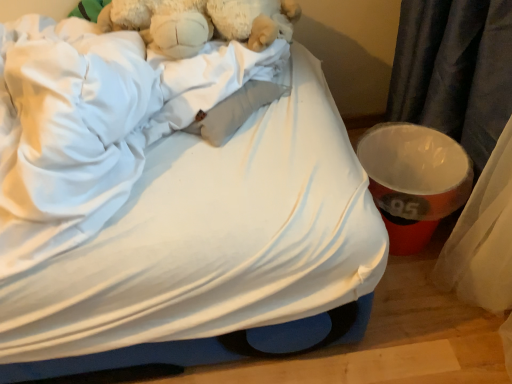
This screenshot has width=512, height=384. Describe the element at coordinates (211, 250) in the screenshot. I see `white fabric bed at upper left` at that location.

Locate an element on the screen. white fabric bed at upper left is located at coordinates (211, 250).

In order to face fluffy white teddy bear at upper left, should I rotate leftwards or rightwards?

A 9.747 degree turn to the left will do.

Where is `fluffy white teddy bear at upper left`? fluffy white teddy bear at upper left is located at coordinates (201, 22).

The height and width of the screenshot is (384, 512). Describe the element at coordinates (201, 22) in the screenshot. I see `fluffy white teddy bear at upper left` at that location.

Measure the distance between point (x=207, y=40) and camera.

They are 34.72 inches apart.

Where is `white fabric bed at upper left`? white fabric bed at upper left is located at coordinates 211,250.

Consider the image. Can you confirm if fluffy white teddy bear at upper left is positioned to the left of white fabric bed at upper left?

Incorrect, fluffy white teddy bear at upper left is not on the left side of white fabric bed at upper left.

In the scene shown: Is the position of fluffy white teddy bear at upper left less distant than that of white fabric bed at upper left?

No, it is not.

Considering the positions of points (161, 26) and (37, 25), is point (161, 26) closer to camera compared to point (37, 25)?

Yes, it is in front of point (37, 25).

From the image's perspective, is fluffy white teddy bear at upper left below white fabric bed at upper left?

Actually, fluffy white teddy bear at upper left appears above white fabric bed at upper left in the image.

From a real-world perspective, is fluffy white teddy bear at upper left physically above white fabric bed at upper left?

Correct, in the physical world, fluffy white teddy bear at upper left is higher than white fabric bed at upper left.

Is fluffy white teddy bear at upper left wider than white fabric bed at upper left?

Incorrect, the width of fluffy white teddy bear at upper left does not surpass that of white fabric bed at upper left.

Can you confirm if fluffy white teddy bear at upper left is shorter than white fabric bed at upper left?

Correct, fluffy white teddy bear at upper left is not as tall as white fabric bed at upper left.

Considering the sizes of objects fluffy white teddy bear at upper left and white fabric bed at upper left in the image provided, who is smaller, fluffy white teddy bear at upper left or white fabric bed at upper left?

With smaller size is fluffy white teddy bear at upper left.

Is fluffy white teddy bear at upper left completely or partially outside of white fabric bed at upper left?

No, fluffy white teddy bear at upper left is inside or overlapping with white fabric bed at upper left.

Is there a large distance between fluffy white teddy bear at upper left and white fabric bed at upper left?

fluffy white teddy bear at upper left is near white fabric bed at upper left, not far away.

Does fluffy white teddy bear at upper left turn towards white fabric bed at upper left?

Yes, fluffy white teddy bear at upper left is oriented towards white fabric bed at upper left.

How much distance is there between fluffy white teddy bear at upper left and white fabric bed at upper left?

11.07 inches.

The height and width of the screenshot is (384, 512). Find the location of `bed on the left side of fluffy white teddy bear at upper left`. bed on the left side of fluffy white teddy bear at upper left is located at coordinates 211,250.

Is white fabric bed at upper left to the right of fluffy white teddy bear at upper left from the viewer's perspective?

In fact, white fabric bed at upper left is to the left of fluffy white teddy bear at upper left.

Is white fabric bed at upper left behind fluffy white teddy bear at upper left?

No, white fabric bed at upper left is closer to the viewer.

Is point (360, 199) positioned before point (286, 31)?

Yes, point (360, 199) is in front of point (286, 31).

From the image's perspective, is white fabric bed at upper left above fluffy white teddy bear at upper left?

No, from the image's perspective, white fabric bed at upper left is not on top of fluffy white teddy bear at upper left.

From a real-world perspective, is white fabric bed at upper left above or below fluffy white teddy bear at upper left?

Clearly, from a real-world perspective, white fabric bed at upper left is below fluffy white teddy bear at upper left.

Can you confirm if white fabric bed at upper left is wider than fluffy white teddy bear at upper left?

Indeed, white fabric bed at upper left has a greater width compared to fluffy white teddy bear at upper left.

Considering the relative sizes of white fabric bed at upper left and fluffy white teddy bear at upper left in the image provided, is white fabric bed at upper left taller than fluffy white teddy bear at upper left?

Correct, white fabric bed at upper left is much taller as fluffy white teddy bear at upper left.

Considering the relative sizes of white fabric bed at upper left and fluffy white teddy bear at upper left in the image provided, is white fabric bed at upper left bigger than fluffy white teddy bear at upper left?

Correct, white fabric bed at upper left is larger in size than fluffy white teddy bear at upper left.

Do you think white fabric bed at upper left is within fluffy white teddy bear at upper left, or outside of it?

The correct answer is: outside.

In the scene shown: Is there a large distance between white fabric bed at upper left and fluffy white teddy bear at upper left?

No, white fabric bed at upper left is in close proximity to fluffy white teddy bear at upper left.

Consider the image. Is white fabric bed at upper left turned away from fluffy white teddy bear at upper left?

Yes, white fabric bed at upper left's orientation is away from fluffy white teddy bear at upper left.

The height and width of the screenshot is (384, 512). I want to click on bed lying below the fluffy white teddy bear at upper left (from the image's perspective), so click(211, 250).

What are the coordinates of `bed below the fluffy white teddy bear at upper left (from the image's perspective)` in the screenshot? It's located at (211, 250).

Where is `teddy bear above the white fabric bed at upper left (from the image's perspective)`? This screenshot has height=384, width=512. teddy bear above the white fabric bed at upper left (from the image's perspective) is located at coordinates (201, 22).